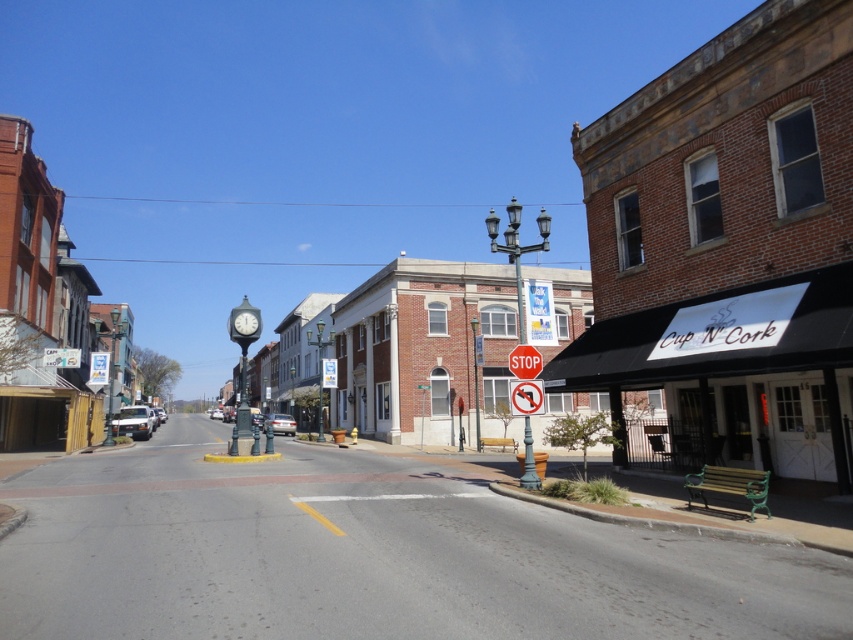
Based on the photo, you are a pedestrian standing on the sidewalk and see the brick building at left and the red matte stop sign at center. Which object is higher in the scene?

The brick building at left is higher than the red matte stop sign at center because it is positioned above it in the scene.

You are standing at the center of the street and want to find the brick building at left. According to the map coordinates, where should you look relative to your position?

The brick building at left is located at point coordinates, so you should look to the left side of the street from your central position.

You are a delivery driver who needs to park your truck between the brick building at left and the red matte stop sign at center. The truck is 12 meters long. Can you fit it there?

The distance between the brick building at left and the red matte stop sign at center is 36.39 meters. Since the truck is 12 meters long, there is sufficient space to park it between them.